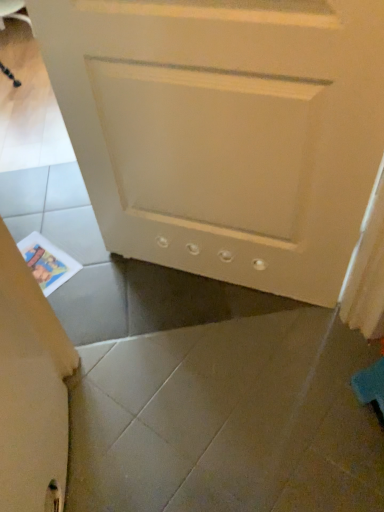
What do you see at coordinates (47, 262) in the screenshot?
I see `printed paper at lower left` at bounding box center [47, 262].

Where is `printed paper at lower left`? The height and width of the screenshot is (512, 384). printed paper at lower left is located at coordinates (47, 262).

From the picture: What is the approximate width of printed paper at lower left?

30.34 centimeters.

The width and height of the screenshot is (384, 512). Describe the element at coordinates (224, 130) in the screenshot. I see `white matte door at center` at that location.

Identify the location of white matte door at center. (224, 130).

What are the coordinates of `printed paper at lower left` in the screenshot? It's located at (47, 262).

Is white matte door at center to the left or to the right of printed paper at lower left in the image?

In the image, white matte door at center appears on the right side of printed paper at lower left.

Between white matte door at center and printed paper at lower left, which one is positioned in front?

white matte door at center is closer to the camera.

Does point (352, 232) appear closer or farther from the camera than point (48, 249)?

Point (352, 232) appears to be closer to the viewer than point (48, 249).

From the image's perspective, between white matte door at center and printed paper at lower left, which one is located above?

white matte door at center, from the image's perspective.

From a real-world perspective, is white matte door at center below printed paper at lower left?

No, from a real-world perspective, white matte door at center is not under printed paper at lower left.

Considering the relative sizes of white matte door at center and printed paper at lower left in the image provided, is white matte door at center wider than printed paper at lower left?

In fact, white matte door at center might be narrower than printed paper at lower left.

Considering the sizes of objects white matte door at center and printed paper at lower left in the image provided, who is taller, white matte door at center or printed paper at lower left?

With more height is white matte door at center.

Who is bigger, white matte door at center or printed paper at lower left?

white matte door at center is bigger.

Which is correct: white matte door at center is inside printed paper at lower left, or outside of it?

white matte door at center is not enclosed by printed paper at lower left.

Can you see white matte door at center touching printed paper at lower left?

white matte door at center is not next to printed paper at lower left, and they're not touching.

Is white matte door at center aimed at printed paper at lower left?

No.

How different are the orientations of white matte door at center and printed paper at lower left in degrees?

white matte door at center and printed paper at lower left are facing 70.2 degrees away from each other.

This screenshot has width=384, height=512. What are the coordinates of `door on the right of printed paper at lower left` in the screenshot? It's located at (224, 130).

In the scene shown: Can you confirm if printed paper at lower left is positioned to the left of white matte door at center?

Correct, you'll find printed paper at lower left to the left of white matte door at center.

Is printed paper at lower left in front of or behind white matte door at center in the image?

printed paper at lower left is behind white matte door at center.

Is point (41, 260) positioned in front of point (88, 185)?

No, it is not.

From the image's perspective, which object appears higher, printed paper at lower left or white matte door at center?

white matte door at center.

From a real-world perspective, is printed paper at lower left on top of white matte door at center?

No, from a real-world perspective, printed paper at lower left is not over white matte door at center

From the picture: Is printed paper at lower left thinner than white matte door at center?

No, printed paper at lower left is not thinner than white matte door at center.

Is printed paper at lower left shorter than white matte door at center?

Indeed, printed paper at lower left has a lesser height compared to white matte door at center.

Does printed paper at lower left have a larger size compared to white matte door at center?

Actually, printed paper at lower left might be smaller than white matte door at center.

Does printed paper at lower left contain white matte door at center?

No.

Is printed paper at lower left placed right next to white matte door at center?

printed paper at lower left and white matte door at center are not in contact.

Is printed paper at lower left positioned with its back to white matte door at center?

No.

Can you tell me how much printed paper at lower left and white matte door at center differ in facing direction?

The angular difference between printed paper at lower left and white matte door at center is 70.2 degrees.

Measure the distance from printed paper at lower left to white matte door at center.

printed paper at lower left and white matte door at center are 28.44 inches apart.

Locate an element on the screen. Image resolution: width=384 pixels, height=512 pixels. door above the printed paper at lower left (from a real-world perspective) is located at coordinates (x=224, y=130).

I want to click on magazine directly beneath the white matte door at center (from a real-world perspective), so click(x=47, y=262).

Identify the location of magazine lying behind the white matte door at center. Image resolution: width=384 pixels, height=512 pixels. (47, 262).